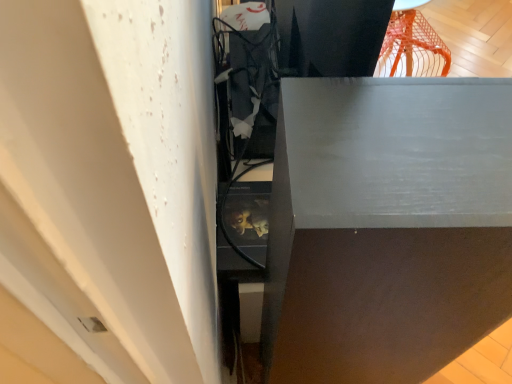
What are the coordinates of `blank space situated above satin silver frame at center (from a real-world perspective)` in the screenshot? It's located at (374, 152).